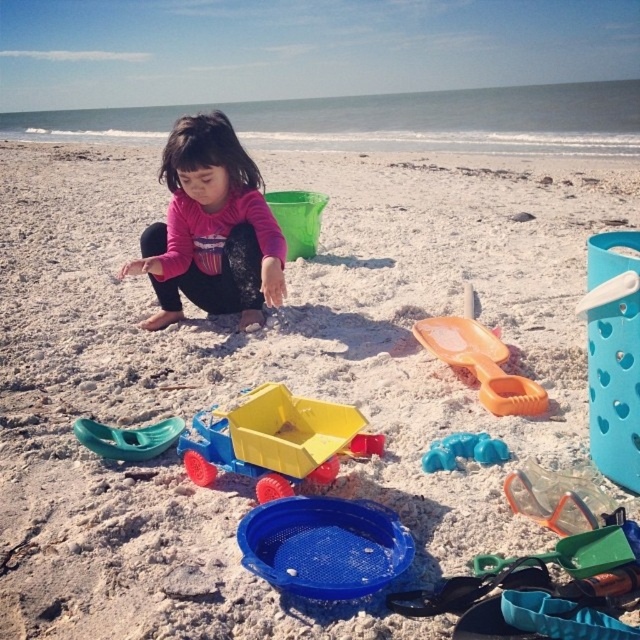
Question: Which object is farther from the camera taking this photo?

Choices:
 (A) teal plastic shovel at lower left
 (B) orange plastic shovel at center

Answer: (B)

Question: Can you confirm if yellow plastic toy truck at center is positioned below teal plastic shovel at lower left?

Choices:
 (A) yes
 (B) no

Answer: (B)

Question: Can you confirm if blue mesh bucket at center is positioned below yellow plastic toy truck at center?

Choices:
 (A) yes
 (B) no

Answer: (A)

Question: Which point is farther from the camera taking this photo?

Choices:
 (A) (468, 456)
 (B) (227, 177)

Answer: (B)

Question: Which point appears closest to the camera in this image?

Choices:
 (A) (250, 451)
 (B) (464, 438)
 (C) (90, 429)

Answer: (A)

Question: Does pink fabric child at center have a lesser width compared to blue mesh bucket at center?

Choices:
 (A) no
 (B) yes

Answer: (A)